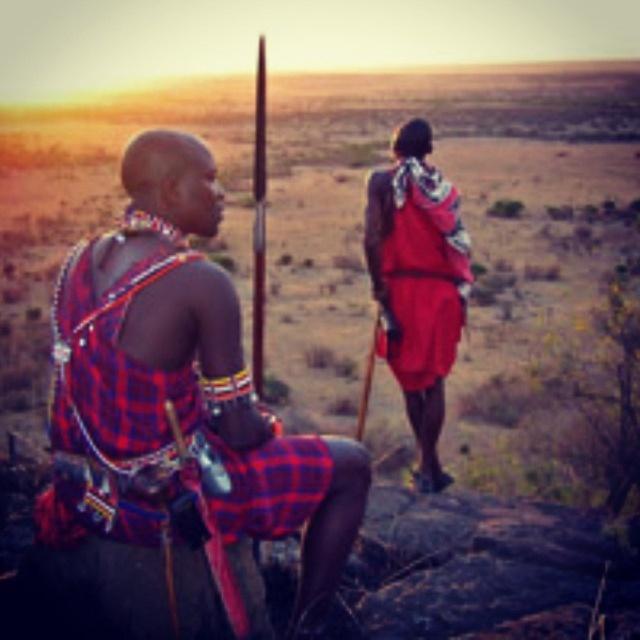
Question: Is plaid fabric shirt at left positioned before red woven cloth at rear?

Choices:
 (A) yes
 (B) no

Answer: (A)

Question: Is plaid fabric shirt at left below red woven cloth at rear?

Choices:
 (A) no
 (B) yes

Answer: (B)

Question: Which point is closer to the camera?

Choices:
 (A) red woven cloth at rear
 (B) plaid fabric shirt at left

Answer: (B)

Question: Does plaid fabric shirt at left appear on the right side of red woven cloth at rear?

Choices:
 (A) yes
 (B) no

Answer: (B)

Question: Which object is farther from the camera taking this photo?

Choices:
 (A) plaid fabric shirt at left
 (B) red woven cloth at rear

Answer: (B)

Question: Which object appears closest to the camera in this image?

Choices:
 (A) plaid fabric shirt at left
 (B) red woven cloth at rear

Answer: (A)